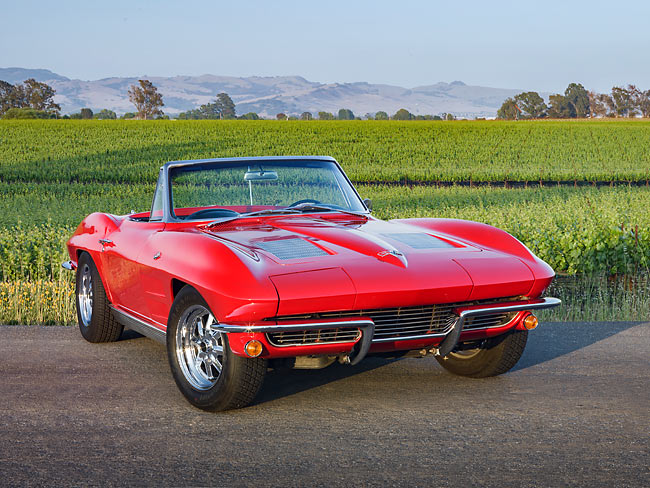
Locate an element on the screen. This screenshot has width=650, height=488. hood is located at coordinates (359, 248).